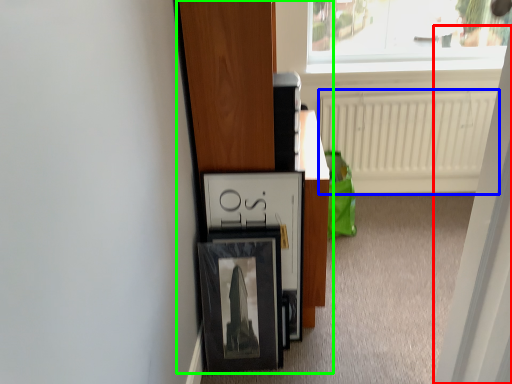
Question: Which is nearer to the screen door (highlighted by a red box)? radiator (highlighted by a blue box) or furniture (highlighted by a green box).

Choices:
 (A) radiator
 (B) furniture

Answer: (B)